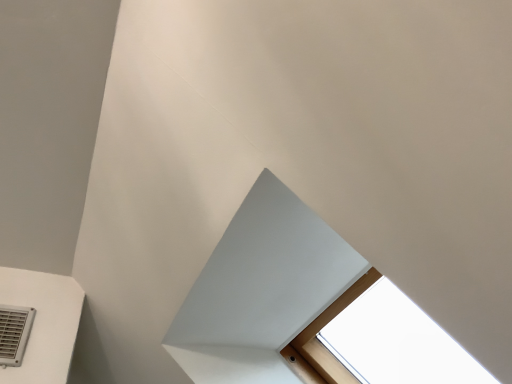
Question: Would you say white matte exhaust hood at center is a long distance from gray plastic air conditioning at lower left?

Choices:
 (A) no
 (B) yes

Answer: (A)

Question: From the image's perspective, is white matte exhaust hood at center on gray plastic air conditioning at lower left?

Choices:
 (A) no
 (B) yes

Answer: (B)

Question: Considering the relative positions of white matte exhaust hood at center and gray plastic air conditioning at lower left in the image provided, is white matte exhaust hood at center behind gray plastic air conditioning at lower left?

Choices:
 (A) yes
 (B) no

Answer: (B)

Question: Does white matte exhaust hood at center come in front of gray plastic air conditioning at lower left?

Choices:
 (A) no
 (B) yes

Answer: (B)

Question: Is white matte exhaust hood at center turned away from gray plastic air conditioning at lower left?

Choices:
 (A) no
 (B) yes

Answer: (A)

Question: Is gray plastic air conditioning at lower left inside white matte exhaust hood at center?

Choices:
 (A) yes
 (B) no

Answer: (B)

Question: From a real-world perspective, is gray plastic air conditioning at lower left beneath white matte exhaust hood at center?

Choices:
 (A) no
 (B) yes

Answer: (A)

Question: Considering the relative sizes of gray plastic air conditioning at lower left and white matte exhaust hood at center in the image provided, is gray plastic air conditioning at lower left thinner than white matte exhaust hood at center?

Choices:
 (A) no
 (B) yes

Answer: (B)

Question: Is gray plastic air conditioning at lower left completely or partially outside of white matte exhaust hood at center?

Choices:
 (A) no
 (B) yes

Answer: (B)

Question: From a real-world perspective, is gray plastic air conditioning at lower left positioned over white matte exhaust hood at center based on gravity?

Choices:
 (A) no
 (B) yes

Answer: (B)

Question: From the image's perspective, is gray plastic air conditioning at lower left on top of white matte exhaust hood at center?

Choices:
 (A) no
 (B) yes

Answer: (A)

Question: Is gray plastic air conditioning at lower left smaller than white matte exhaust hood at center?

Choices:
 (A) no
 (B) yes

Answer: (B)

Question: Relative to white matte exhaust hood at center, is gray plastic air conditioning at lower left in front or behind?

Choices:
 (A) behind
 (B) front

Answer: (A)